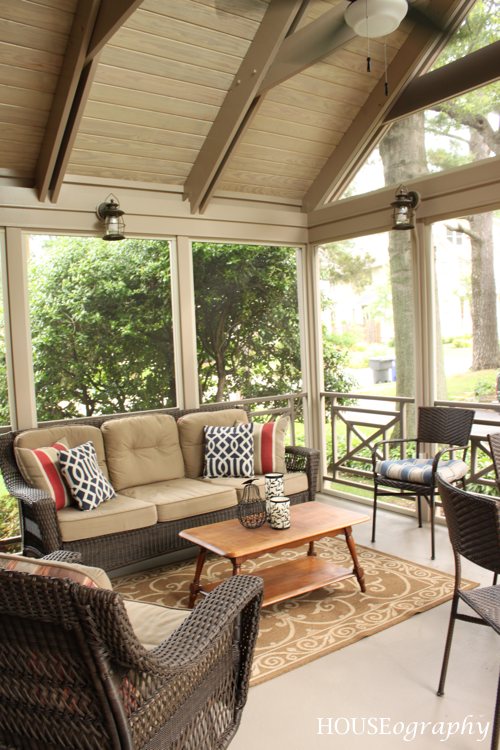
Locate an element on the screen. This screenshot has width=500, height=750. fan is located at coordinates (242, 6), (436, 27), (313, 46).